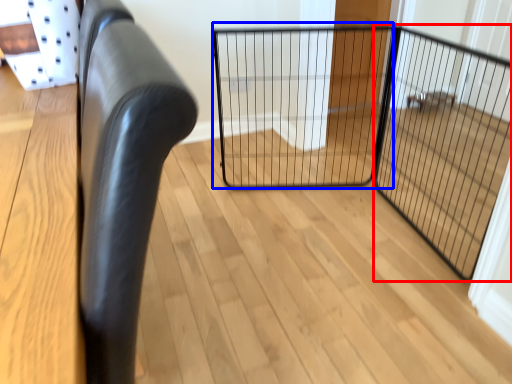
Question: Which object appears closest to the camera in this image, screen door (highlighted by a red box) or cage (highlighted by a blue box)?

Choices:
 (A) screen door
 (B) cage

Answer: (A)